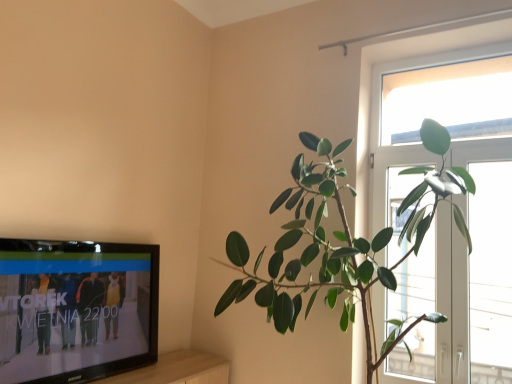
Question: In terms of width, does transparent glass window at right, arranged as the second window when viewed from the left, look wider or thinner when compared to transparent glass window at upper right?

Choices:
 (A) wide
 (B) thin

Answer: (A)

Question: Is transparent glass window at right, arranged as the second window when viewed from the left, inside or outside of transparent glass window at upper right?

Choices:
 (A) outside
 (B) inside

Answer: (A)

Question: Which of these objects is positioned closest to the transparent glass window at upper right?

Choices:
 (A) green glossy plant at right
 (B) transparent glass window at right, arranged as the second window when viewed from the left
 (C) transparent glass window at upper right, arranged as the 2th window when viewed from the right

Answer: (C)

Question: Estimate the real-world distances between objects in this image. Which object is farther from the green glossy plant at right?

Choices:
 (A) transparent glass window at upper right, arranged as the 2th window when viewed from the right
 (B) transparent glass window at upper right
 (C) transparent glass window at right, arranged as the second window when viewed from the left

Answer: (B)